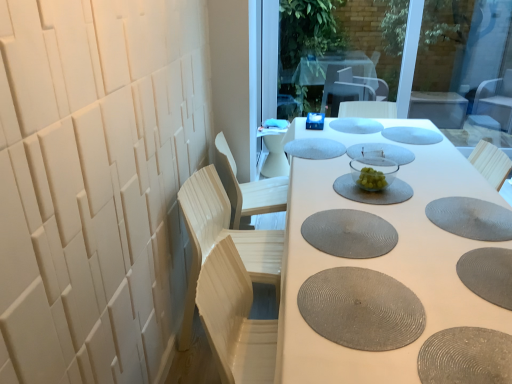
Locate an element on the screen. The height and width of the screenshot is (384, 512). free space above blue fabric cushion at center, the first manhole cover in the back-to-front sequence (from a real-world perspective) is located at coordinates (352, 120).